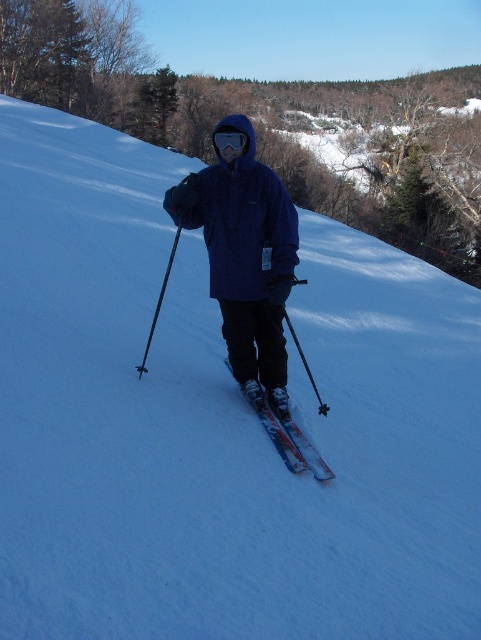
You are a photographer capturing the skier in the image. You notice the matte blue jacket at center and the shiny metallic skis at center. Which object should you focus on if you want to highlight the skier in the scene?

The matte blue jacket at center is above the shiny metallic skis at center, so focusing on the jacket would highlight the skier since it is positioned higher and directly on the person.

You are a photographer trying to capture the skier. You want to focus on the matte blue jacket at center without the shiny metallic skis at center appearing in the foreground. Is this possible based on their positions?

The matte blue jacket at center is further to the viewer than the shiny metallic skis at center, so the jacket is closer to you. This means the skis would be behind the jacket in the photo, so you can focus on the matte blue jacket at center without the skis appearing in the foreground.

You are a photographer taking a picture of the scene. You want to focus on the matte blue jacket at center and the shiny metallic skis at center. Which object should you adjust your camera to the left to capture better?

The matte blue jacket at center is positioned on the left side of the shiny metallic skis at center, so adjusting the camera to the left would better capture the matte blue jacket at center.